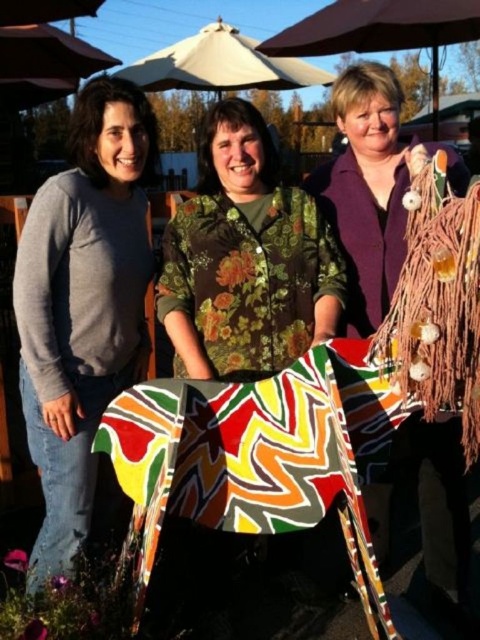
You are a photographer trying to capture a photo of the matte gray sweater at left and the beige fabric umbrella at upper center. Based on their positions, which object is closer to the ground?

The matte gray sweater at left is located below the beige fabric umbrella at upper center, so the sweater is closer to the ground.